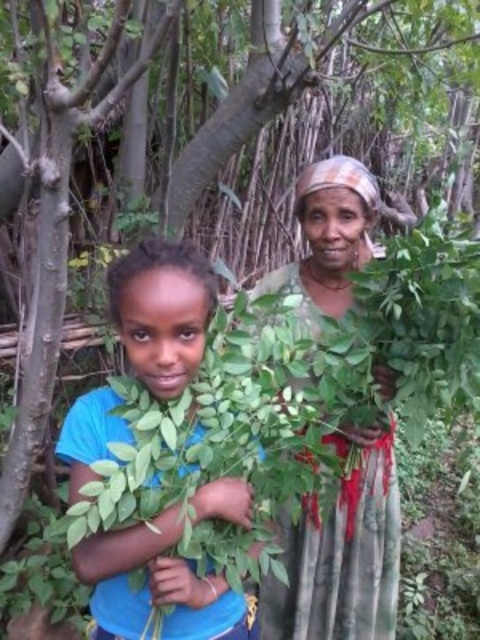
You are a fashion designer observing two outfits in the image. The first is a blue fabric shirt at center and the second is a green fabric dress at center. Which outfit is taller?

The blue fabric shirt at center is taller than the green fabric dress at center.